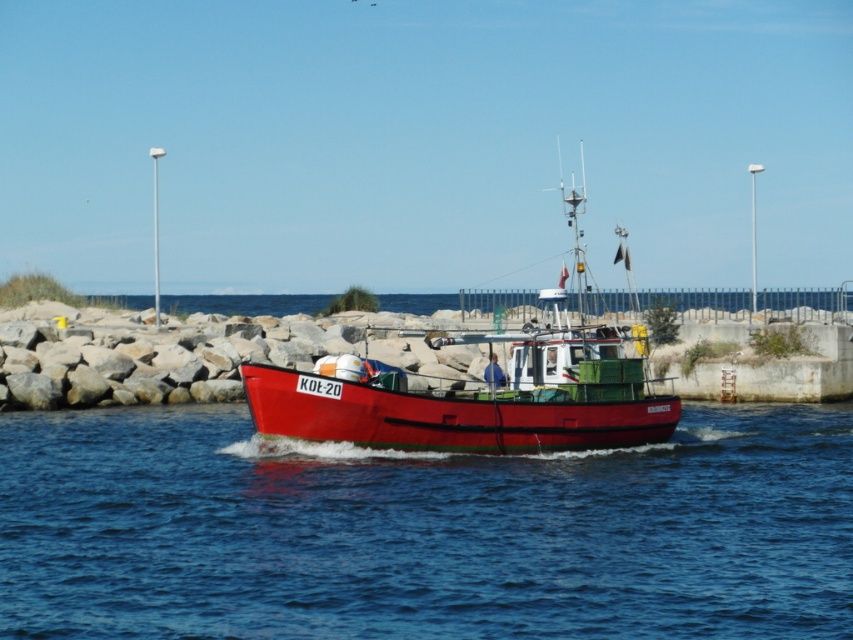
You are a sailor on the shiny red boat at center. You need to determine if you can safely lower a large fishing net into the blue water at center without the net getting tangled in the boat. Based on the height difference between the boat and the water, can you do this?

The blue water at center is not as tall as the shiny red boat at center, meaning the boat is taller than the water. Since the boat is taller, you can safely lower the fishing net into the blue water at center without it getting tangled.

You are on the red fishing boat with registration number K01 20 and want to move from point (335, 397) to point (688, 429). Is the destination point behind the starting point from your current position?

Yes, the destination point (688, 429) is behind the starting point (335, 397) from your current position on the boat.